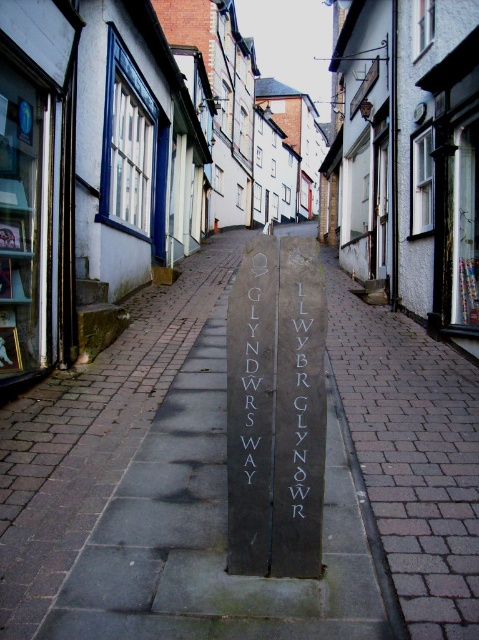
Question: Does dark gray stone marker at center have a greater width compared to slate gray stone sign at center?

Choices:
 (A) yes
 (B) no

Answer: (A)

Question: Does slate gray stone sign at center have a lesser width compared to white stone writing at center?

Choices:
 (A) yes
 (B) no

Answer: (A)

Question: Based on their relative distances, which object is farther from the dark gray stone marker at center?

Choices:
 (A) slate gray stone sign at center
 (B) white stone writing at center

Answer: (A)

Question: Which point appears closest to the camera in this image?

Choices:
 (A) (241, 390)
 (B) (306, 337)

Answer: (B)

Question: Considering the real-world distances, which object is closest to the white stone writing at center?

Choices:
 (A) dark gray stone marker at center
 (B) slate gray stone sign at center

Answer: (B)

Question: Where is slate gray stone sign at center located in relation to white stone writing at center in the image?

Choices:
 (A) above
 (B) below

Answer: (A)